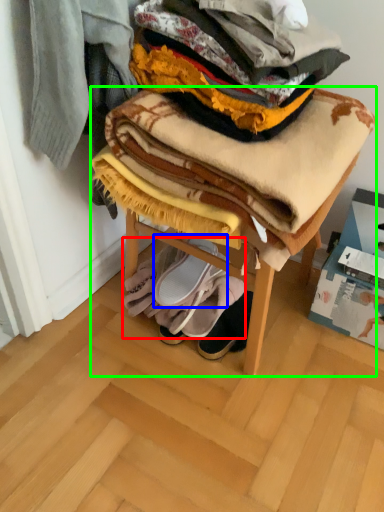
Question: Which object is the farthest from blanket (highlighted by a red box)? Choose among these: footwear (highlighted by a blue box) or furniture (highlighted by a green box).

Choices:
 (A) footwear
 (B) furniture

Answer: (B)